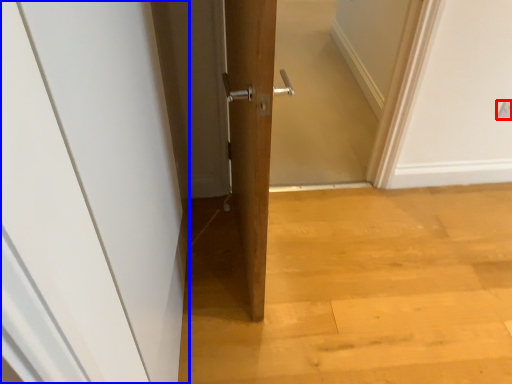
Question: Which object is closer to the camera taking this photo, electric outlet (highlighted by a red box) or door (highlighted by a blue box)?

Choices:
 (A) electric outlet
 (B) door

Answer: (B)